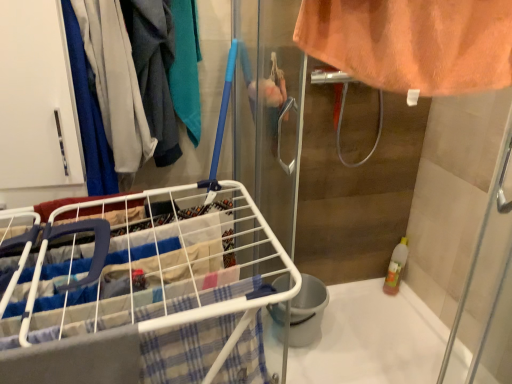
Question: From the image's perspective, is white wire laundry cart at lower left positioned above or below white glossy bath at lower right?

Choices:
 (A) above
 (B) below

Answer: (A)

Question: Considering the relative positions of white wire laundry cart at lower left and white glossy bath at lower right in the image provided, is white wire laundry cart at lower left to the left or to the right of white glossy bath at lower right?

Choices:
 (A) right
 (B) left

Answer: (B)

Question: Based on their relative distances, which object is farther from the matte blue fabric at left?

Choices:
 (A) white wire laundry cart at lower left
 (B) white glossy bath at lower right

Answer: (B)

Question: Based on their relative distances, which object is nearer to the white glossy bath at lower right?

Choices:
 (A) white wire laundry cart at lower left
 (B) matte blue fabric at left

Answer: (A)